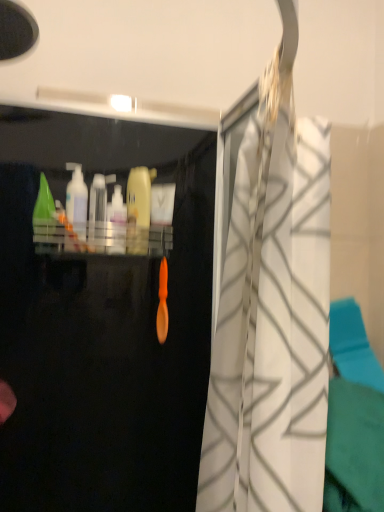
Question: Is translucent plastic bottle at center, the second cleaning product viewed from the right, to the left or to the right of green plastic cone at upper left, which ranks as the first cleaning product in left-to-right order, in the image?

Choices:
 (A) right
 (B) left

Answer: (A)

Question: From a real-world perspective, is translucent plastic bottle at center, the second cleaning product viewed from the right, physically located above or below green plastic cone at upper left, which is counted as the fourth cleaning product, starting from the right?

Choices:
 (A) below
 (B) above

Answer: (A)

Question: Which object is the farthest from the yellow matte bottle at center, arranged as the 4th cleaning product when viewed from the left?

Choices:
 (A) white textured curtain at center
 (B) translucent plastic bottle at center, the second cleaning product viewed from the right
 (C) green plastic cone at upper left, which ranks as the first cleaning product in left-to-right order
 (D) translucent plastic bottle at left, positioned as the 3th cleaning product in right-to-left order
 (E) transparent plastic bottle at center

Answer: (A)

Question: Considering the real-world distances, which object is farthest from the transparent plastic bottle at center?

Choices:
 (A) translucent plastic bottle at left, positioned as the 3th cleaning product in right-to-left order
 (B) green plastic cone at upper left, which ranks as the first cleaning product in left-to-right order
 (C) yellow matte bottle at center, which is the first cleaning product in right-to-left order
 (D) white textured curtain at center
 (E) translucent plastic bottle at center, acting as the third cleaning product starting from the left

Answer: (D)